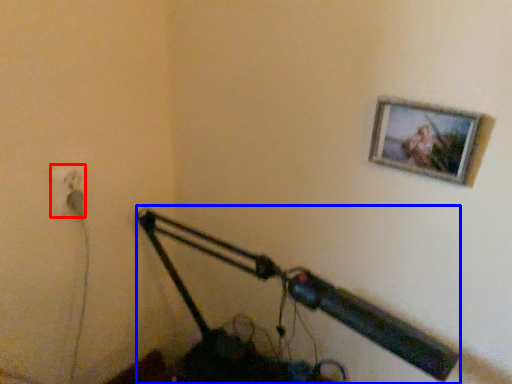
Question: Among these objects, which one is farthest to the camera, electric outlet (highlighted by a red box) or lamp (highlighted by a blue box)?

Choices:
 (A) electric outlet
 (B) lamp

Answer: (A)